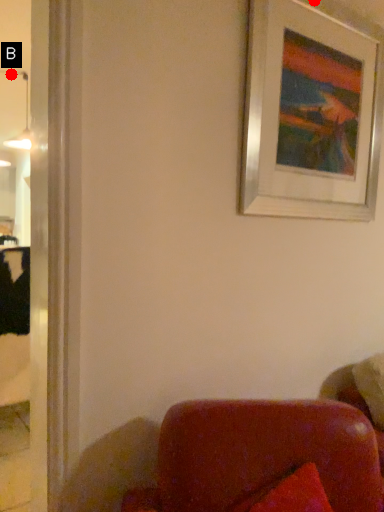
Question: Two points are circled on the image, labeled by A and B beside each circle. Which point is closer to the camera taking this photo?

Choices:
 (A) A is closer
 (B) B is closer

Answer: (A)